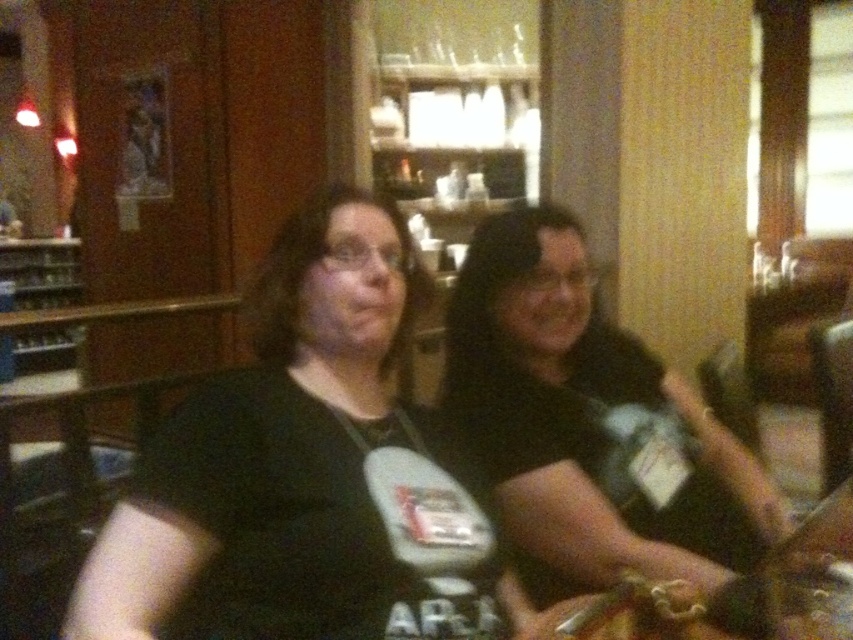
Is point (280, 540) closer to camera compared to point (647, 474)?

Yes.

Does black matte t-shirt at center have a greater height compared to clear plastic bottle at center?

Correct, black matte t-shirt at center is much taller as clear plastic bottle at center.

What do you see at coordinates (297, 465) in the screenshot?
I see `black matte t-shirt at center` at bounding box center [297, 465].

At what (x,y) coordinates should I click in order to perform the action: click on black matte t-shirt at center. Please return your answer as a coordinate pair (x, y). The image size is (853, 640). Looking at the image, I should click on (297, 465).

At what (x,y) coordinates should I click in order to perform the action: click on black matte t-shirt at center. Please return your answer as a coordinate pair (x, y). Looking at the image, I should click on (297, 465).

Between black matte t-shirt at center and black matte shirt at center, which one appears on the left side from the viewer's perspective?

black matte t-shirt at center is more to the left.

Locate an element on the screen. The height and width of the screenshot is (640, 853). black matte t-shirt at center is located at coordinates (297, 465).

How distant is black matte shirt at center from clear plastic bottle at center?

black matte shirt at center and clear plastic bottle at center are 3.96 inches apart.

Between point (503, 294) and point (646, 429), which one is positioned in front?

Point (646, 429) is more forward.

Between point (584, 256) and point (618, 406), which one is positioned behind?

The point (584, 256) is more distant.

The width and height of the screenshot is (853, 640). Find the location of `black matte shirt at center`. black matte shirt at center is located at coordinates (590, 426).